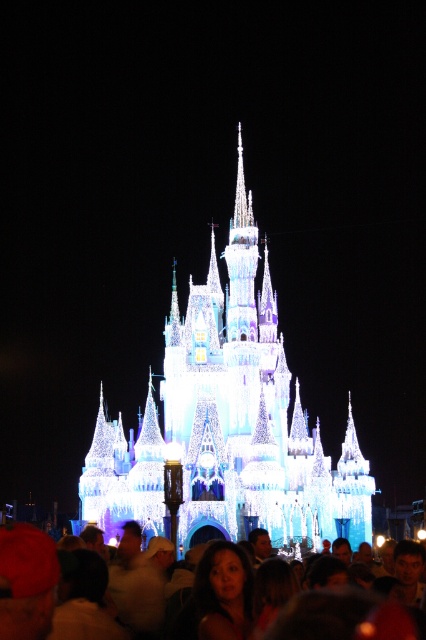
Is point (98, 426) less distant than point (40, 564)?

No, (98, 426) is further to viewer.

Does illuminated glass castle at center have a lesser width compared to matte white crowd at lower center?

Incorrect, illuminated glass castle at center's width is not less than matte white crowd at lower center's.

Where is `illuminated glass castle at center`? illuminated glass castle at center is located at coordinates (227, 424).